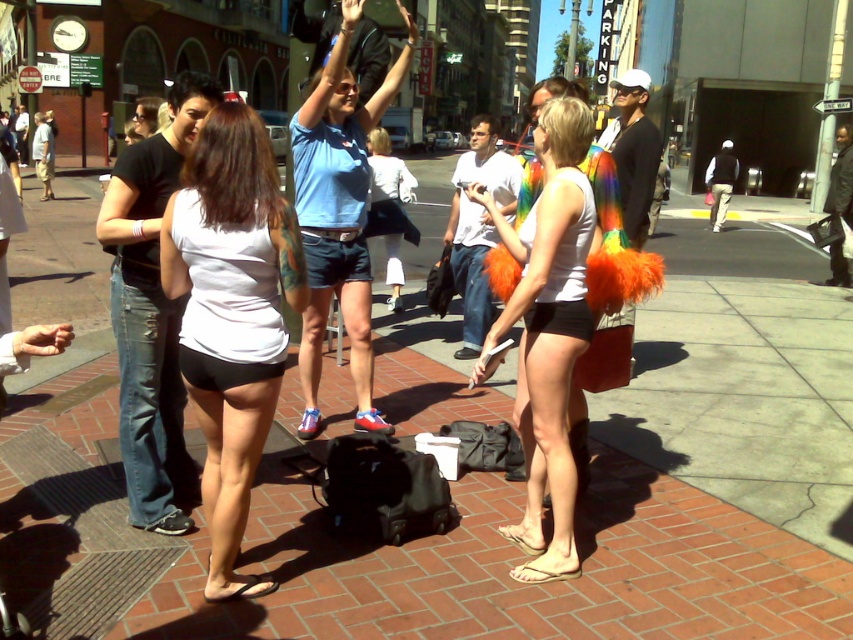
What do you see at coordinates (339, 211) in the screenshot?
I see `matte blue shirt at center` at bounding box center [339, 211].

Based on the photo, is matte blue shirt at center above tan leather sandal at lower center?

Yes, matte blue shirt at center is above tan leather sandal at lower center.

Describe the element at coordinates (339, 211) in the screenshot. I see `matte blue shirt at center` at that location.

Locate an element on the screen. This screenshot has width=853, height=640. matte blue shirt at center is located at coordinates (339, 211).

Is white matte shorts at lower left taller than white matte shorts at center?

In fact, white matte shorts at lower left may be shorter than white matte shorts at center.

Between point (222, 484) and point (573, 237), which one is positioned behind?

The point (573, 237) is more distant.

Does point (196, 176) come farther from viewer compared to point (526, 548)?

No, (196, 176) is in front of (526, 548).

Find the location of a particular element. Image resolution: width=853 pixels, height=640 pixels. white matte shorts at lower left is located at coordinates (231, 316).

Between point (289, 257) and point (573, 573), which one is positioned in front?

Point (289, 257)

From the picture: Can you confirm if white matte shorts at lower left is positioned to the left of tan leather sandal at lower center?

Indeed, white matte shorts at lower left is positioned on the left side of tan leather sandal at lower center.

Measure the distance between point (241, 209) and camera.

They are 2.80 meters apart.

Identify the location of white matte shorts at lower left. This screenshot has height=640, width=853. (231, 316).